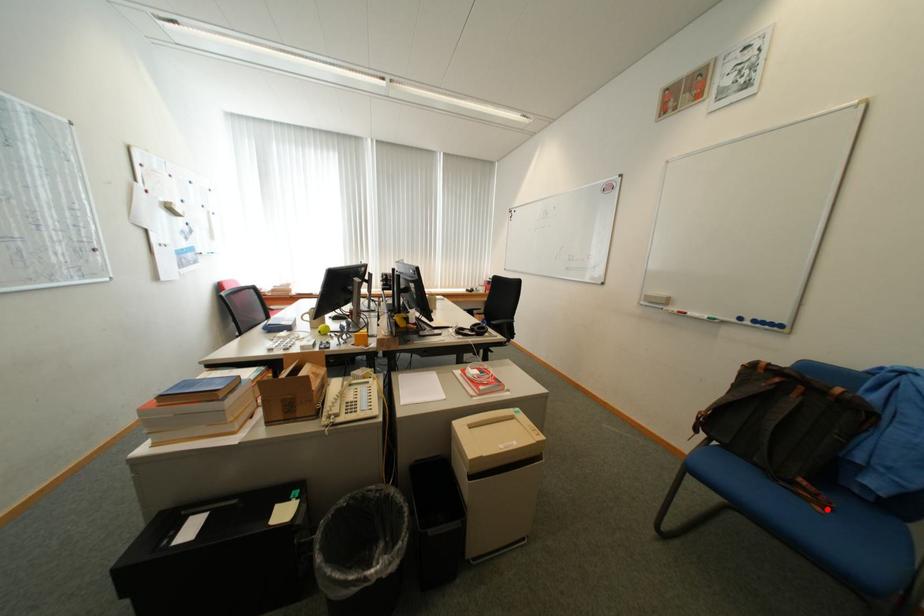
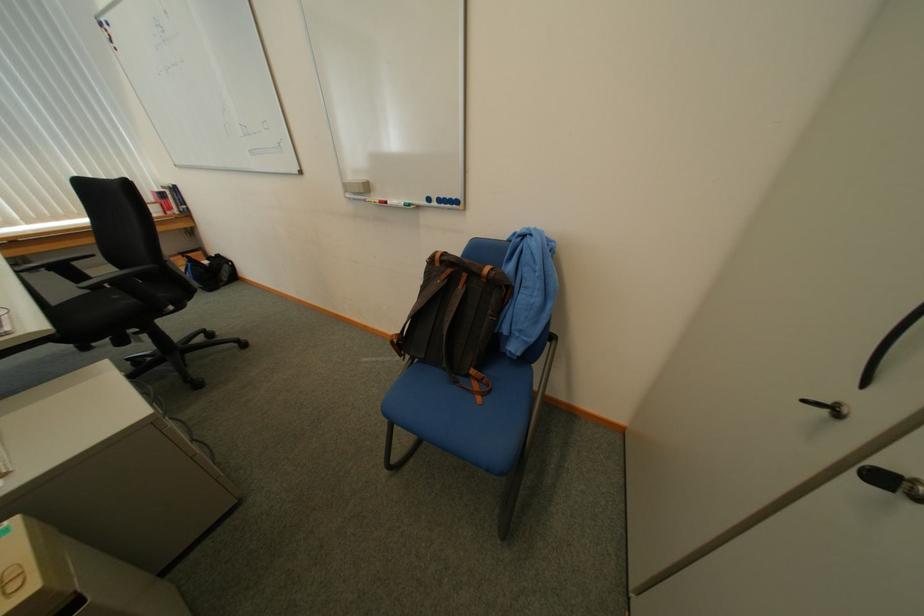
Question: A red point is marked in image1. In image2, is the corresponding 3D point closer to the camera or farther? Reply with the corresponding letter.

Choices:
 (A) The corresponding 3D point is closer.
 (B) The corresponding 3D point is farther.

Answer: (B)